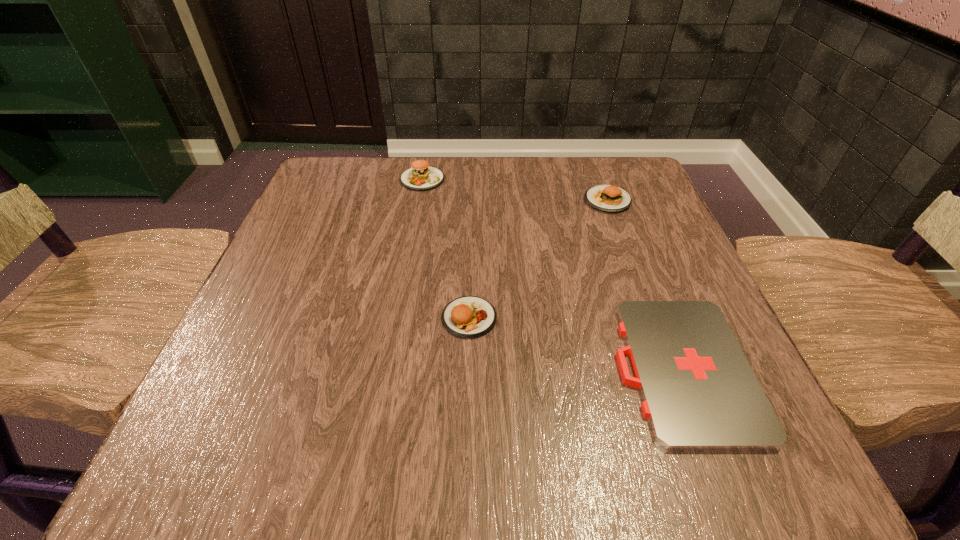
Where is `free region located 0.380m on handle side the shortest object`? This screenshot has width=960, height=540. free region located 0.380m on handle side the shortest object is located at coordinates (360, 369).

Identify the location of object that is at the near edge. (699, 392).

What are the coordinates of `food situated at the right edge` in the screenshot? It's located at (606, 198).

Identify the location of the first-aid kit positioned at the right edge. (699, 392).

At what (x,y) coordinates should I click in order to perform the action: click on object at the far right corner. Please return your answer as a coordinate pair (x, y). Image resolution: width=960 pixels, height=540 pixels. Looking at the image, I should click on (606, 198).

Where is `object present at the near right corner`? object present at the near right corner is located at coordinates (699, 392).

In the image, there is a desktop. Identify the location of free space at the far edge. coord(492,200).

This screenshot has width=960, height=540. In order to click on free location at the near edge of the desktop in this screenshot , I will do `click(426, 455)`.

This screenshot has height=540, width=960. What are the coordinates of `vacant space at the left edge of the desktop` in the screenshot? It's located at (301, 273).

In the image, there is a desktop. Find the location of `free region at the right edge`. free region at the right edge is located at coordinates (625, 255).